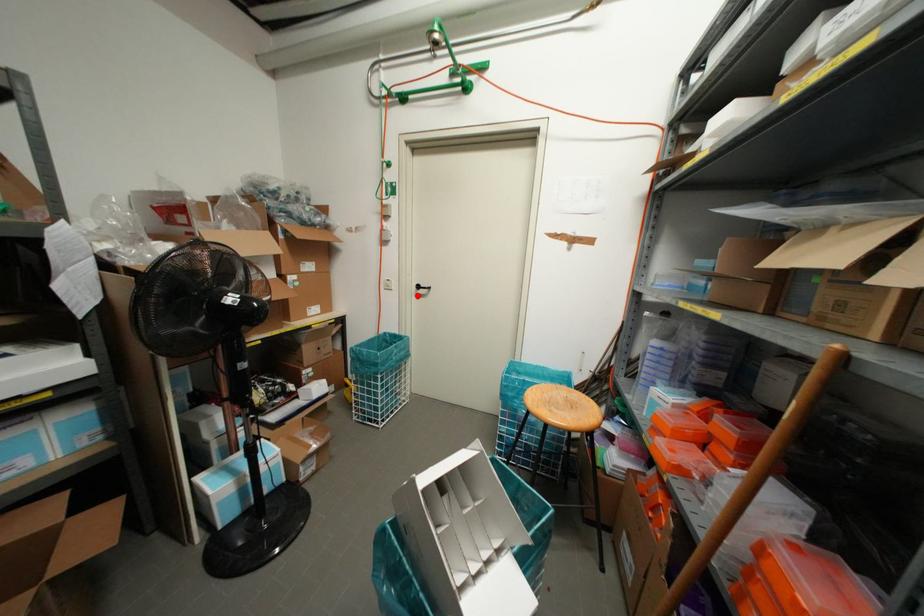
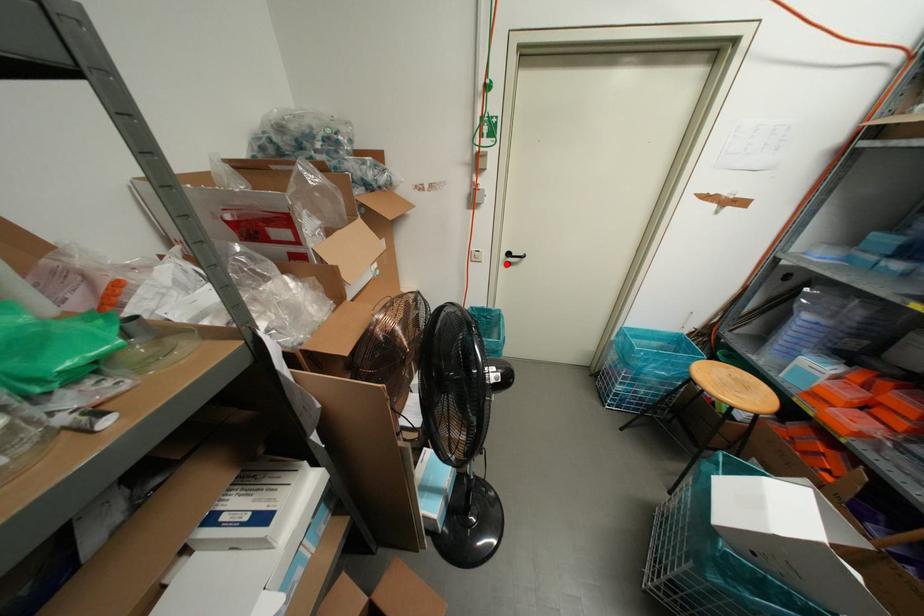
I am providing you with two images of the same scene from different viewpoints. A red point is marked on the first image and another point is marked on the second image. Does the point marked in image1 correspond to the same location as the one in image2?

Yes